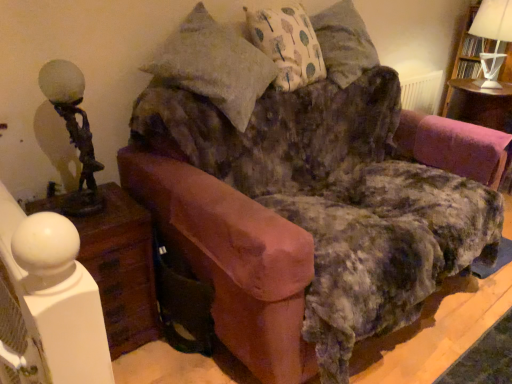
The width and height of the screenshot is (512, 384). Identify the location of white fabric lampshade at upper right, positioned as the 1th table lamp in right-to-left order. (492, 37).

The image size is (512, 384). I want to click on white paper lampshade at upper right, so click(463, 59).

The width and height of the screenshot is (512, 384). Find the location of `velvet pink swivel chair at right`. velvet pink swivel chair at right is located at coordinates 454,146.

Locate an element on the screen. white fabric pillow with tree pattern at upper center is located at coordinates (288, 45).

Is velvet pink swivel chair at right touching bronze/golden statue-like at left, acting as the 1th table lamp starting from the bottom?

No, velvet pink swivel chair at right is not making contact with bronze/golden statue-like at left, acting as the 1th table lamp starting from the bottom.

Does velvet pink swivel chair at right have a greater width compared to bronze/golden statue-like at left, the 1th table lamp when ordered from left to right?

Yes, velvet pink swivel chair at right is wider than bronze/golden statue-like at left, the 1th table lamp when ordered from left to right.

Which is more to the left, velvet pink swivel chair at right or bronze/golden statue-like at left, which appears as the 1th table lamp when viewed from the front?

Positioned to the left is bronze/golden statue-like at left, which appears as the 1th table lamp when viewed from the front.

Does point (436, 160) come behind point (54, 103)?

That is True.

Is point (274, 25) positioned behind point (499, 36)?

No.

From a real-world perspective, is white fabric pillow with tree pattern at upper center positioned over white fabric lampshade at upper right, positioned as the 1th table lamp in right-to-left order, based on gravity?

Indeed, from a real-world perspective, white fabric pillow with tree pattern at upper center stands above white fabric lampshade at upper right, positioned as the 1th table lamp in right-to-left order.

This screenshot has width=512, height=384. I want to click on pillow that is on the left side of white fabric lampshade at upper right, which is the 1th table lamp from top to bottom, so click(288, 45).

Is white fabric pillow with tree pattern at upper center bigger or smaller than white fabric lampshade at upper right, positioned as the 1th table lamp in right-to-left order?

white fabric pillow with tree pattern at upper center is bigger than white fabric lampshade at upper right, positioned as the 1th table lamp in right-to-left order.

Could you tell me if white fabric lampshade at upper right, which is the 1th table lamp from top to bottom, is turned towards white paper lampshade at upper right?

No, white fabric lampshade at upper right, which is the 1th table lamp from top to bottom, is not facing towards white paper lampshade at upper right.

From the image's perspective, which one is positioned lower, white fabric lampshade at upper right, which is the 1th table lamp from top to bottom, or white paper lampshade at upper right?

white fabric lampshade at upper right, which is the 1th table lamp from top to bottom, is shown below in the image.

Is white fabric lampshade at upper right, positioned as the 1th table lamp in right-to-left order, wider than white paper lampshade at upper right?

Yes.

Considering the relative positions of white fabric lampshade at upper right, arranged as the second table lamp when viewed from the left, and white paper lampshade at upper right in the image provided, is white fabric lampshade at upper right, arranged as the second table lamp when viewed from the left, to the right of white paper lampshade at upper right from the viewer's perspective?

No, white fabric lampshade at upper right, arranged as the second table lamp when viewed from the left, is not to the right of white paper lampshade at upper right.

Can you tell me how much white fabric lampshade at upper right, arranged as the second table lamp when viewed from the left, and bronze/golden statue-like at left, the 1th table lamp when ordered from left to right, differ in facing direction?

The angular difference between white fabric lampshade at upper right, arranged as the second table lamp when viewed from the left, and bronze/golden statue-like at left, the 1th table lamp when ordered from left to right, is 4.08 degrees.

Is white fabric lampshade at upper right, positioned as the 2th table lamp in front-to-back order, oriented away from bronze/golden statue-like at left, arranged as the second table lamp when viewed from the top?

No, white fabric lampshade at upper right, positioned as the 2th table lamp in front-to-back order, is not facing the opposite direction of bronze/golden statue-like at left, arranged as the second table lamp when viewed from the top.

In the image, is white fabric lampshade at upper right, which is the 1th table lamp from top to bottom, on the left side or the right side of bronze/golden statue-like at left, arranged as the second table lamp when viewed from the top?

In the image, white fabric lampshade at upper right, which is the 1th table lamp from top to bottom, appears on the right side of bronze/golden statue-like at left, arranged as the second table lamp when viewed from the top.

Is white fabric lampshade at upper right, the 2th table lamp when ordered from bottom to top, situated inside bronze/golden statue-like at left, arranged as the second table lamp when viewed from the top, or outside?

The correct answer is: outside.

Which point is more distant from viewer, (416, 149) or (89, 225)?

The point (416, 149) is farther.

Does velvet pink swivel chair at right lie in front of white wood nightstand at lower left?

No, velvet pink swivel chair at right is further to the viewer.

Which object is positioned more to the right, velvet pink swivel chair at right or white wood nightstand at lower left?

velvet pink swivel chair at right is more to the right.

Identify the location of swivel chair on the right of white wood nightstand at lower left. (454, 146).

This screenshot has width=512, height=384. In the image, there is a white wood nightstand at lower left. What are the coordinates of `bookshelf above it (from the image's perspective)` in the screenshot? It's located at (463, 59).

Does point (149, 298) come farther from viewer compared to point (469, 28)?

No, it is in front of (469, 28).

Can you confirm if white wood nightstand at lower left is positioned to the right of white paper lampshade at upper right?

Incorrect, white wood nightstand at lower left is not on the right side of white paper lampshade at upper right.

Consider the image. Could you tell me if white paper lampshade at upper right is facing velvet pink swivel chair at right?

No.

Does white paper lampshade at upper right have a lesser width compared to velvet pink swivel chair at right?

Yes.

In terms of height, does white paper lampshade at upper right look taller or shorter compared to velvet pink swivel chair at right?

Clearly, white paper lampshade at upper right is taller compared to velvet pink swivel chair at right.

From a real-world perspective, relative to velvet pink swivel chair at right, is white paper lampshade at upper right vertically above or below?

From a real-world perspective, white paper lampshade at upper right is physically above velvet pink swivel chair at right.

This screenshot has height=384, width=512. What are the coordinates of `swivel chair behind the bronze/golden statue-like at left, acting as the 1th table lamp starting from the bottom` in the screenshot? It's located at (454, 146).

Image resolution: width=512 pixels, height=384 pixels. I want to click on pillow in front of the white fabric lampshade at upper right, positioned as the 1th table lamp in right-to-left order, so click(x=288, y=45).

Based on their spatial positions, is white fabric lampshade at upper right, which is the 1th table lamp from top to bottom, or white fabric pillow with tree pattern at upper center further from white paper lampshade at upper right?

Based on the image, white fabric pillow with tree pattern at upper center appears to be further to white paper lampshade at upper right.

From the image, which object appears to be farther from velvet pink swivel chair at right, bronze/golden statue-like at left, arranged as the 2th table lamp when viewed from the right, or white fabric lampshade at upper right, positioned as the 2th table lamp in front-to-back order?

bronze/golden statue-like at left, arranged as the 2th table lamp when viewed from the right, is positioned further to the anchor velvet pink swivel chair at right.

Estimate the real-world distances between objects in this image. Which object is closer to white fabric pillow with tree pattern at upper center, bronze/golden statue-like at left, which appears as the 1th table lamp when viewed from the front, or white fabric lampshade at upper right, positioned as the 1th table lamp in right-to-left order?

bronze/golden statue-like at left, which appears as the 1th table lamp when viewed from the front, lies closer to white fabric pillow with tree pattern at upper center than the other object.

From the image, which object appears to be farther from white wood nightstand at lower left, white fabric lampshade at upper right, the 2th table lamp when ordered from bottom to top, or velvet pink swivel chair at right?

The object further to white wood nightstand at lower left is white fabric lampshade at upper right, the 2th table lamp when ordered from bottom to top.

Looking at the image, which one is located closer to white fabric pillow with tree pattern at upper center, bronze/golden statue-like at left, which appears as the 1th table lamp when viewed from the front, or white wood nightstand at lower left?

Among the two, bronze/golden statue-like at left, which appears as the 1th table lamp when viewed from the front, is located nearer to white fabric pillow with tree pattern at upper center.

Estimate the real-world distances between objects in this image. Which object is closer to bronze/golden statue-like at left, positioned as the second table lamp in back-to-front order, white wood nightstand at lower left or white paper lampshade at upper right?

Among the two, white wood nightstand at lower left is located nearer to bronze/golden statue-like at left, positioned as the second table lamp in back-to-front order.

Consider the image. Which object lies further to the anchor point velvet pink swivel chair at right, white paper lampshade at upper right or bronze/golden statue-like at left, positioned as the second table lamp in back-to-front order?

The object further to velvet pink swivel chair at right is bronze/golden statue-like at left, positioned as the second table lamp in back-to-front order.

Estimate the real-world distances between objects in this image. Which object is closer to bronze/golden statue-like at left, arranged as the 2th table lamp when viewed from the right, white paper lampshade at upper right or white fabric pillow with tree pattern at upper center?

Among the two, white fabric pillow with tree pattern at upper center is located nearer to bronze/golden statue-like at left, arranged as the 2th table lamp when viewed from the right.

You are a GUI agent. You are given a task and a screenshot of the screen. Output one action in this format:
    pyautogui.click(x=<x>, y=<y>)
    Task: Click on the table lamp between bronze/golden statue-like at left, arranged as the second table lamp when viewed from the top, and white paper lampshade at upper right from left to right
    
    Given the screenshot: What is the action you would take?
    pyautogui.click(x=492, y=37)

Locate an element on the screen. This screenshot has width=512, height=384. swivel chair between white wood nightstand at lower left and white fabric lampshade at upper right, which is the 1th table lamp from top to bottom is located at coordinates (454, 146).

Where is `pillow between bronze/golden statue-like at left, positioned as the second table lamp in back-to-front order, and white paper lampshade at upper right`? Image resolution: width=512 pixels, height=384 pixels. pillow between bronze/golden statue-like at left, positioned as the second table lamp in back-to-front order, and white paper lampshade at upper right is located at coordinates (288, 45).

Where is `table lamp between white fabric pillow with tree pattern at upper center and white paper lampshade at upper right in the horizontal direction`? The height and width of the screenshot is (384, 512). table lamp between white fabric pillow with tree pattern at upper center and white paper lampshade at upper right in the horizontal direction is located at coordinates (492, 37).